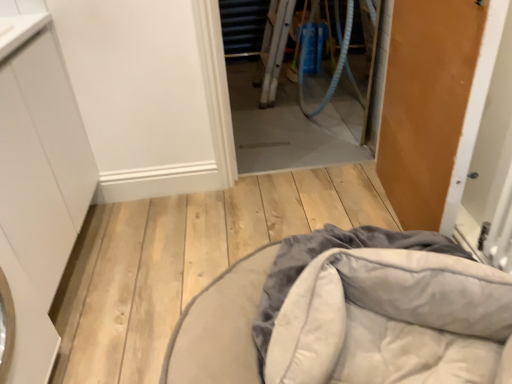
Question: Is transparent plastic screen door at center wider than white matte cabinet at left?

Choices:
 (A) no
 (B) yes

Answer: (A)

Question: From the image's perspective, is transparent plastic screen door at center below white matte cabinet at left?

Choices:
 (A) yes
 (B) no

Answer: (B)

Question: From a real-world perspective, is transparent plastic screen door at center located beneath white matte cabinet at left?

Choices:
 (A) yes
 (B) no

Answer: (A)

Question: Is transparent plastic screen door at center far from white matte cabinet at left?

Choices:
 (A) no
 (B) yes

Answer: (B)

Question: Is transparent plastic screen door at center looking in the opposite direction of white matte cabinet at left?

Choices:
 (A) yes
 (B) no

Answer: (B)

Question: In the image, is transparent plastic screen door at center positioned in front of or behind white matte cabinet at left?

Choices:
 (A) behind
 (B) front

Answer: (A)

Question: Is transparent plastic screen door at center wider or thinner than white matte cabinet at left?

Choices:
 (A) thin
 (B) wide

Answer: (A)

Question: From a real-world perspective, is transparent plastic screen door at center above or below white matte cabinet at left?

Choices:
 (A) below
 (B) above

Answer: (A)

Question: Is transparent plastic screen door at center bigger or smaller than white matte cabinet at left?

Choices:
 (A) small
 (B) big

Answer: (A)

Question: From the image's perspective, is transparent plastic screen door at center above or below wooden door at right?

Choices:
 (A) below
 (B) above

Answer: (B)

Question: Does point (300, 94) appear closer or farther from the camera than point (432, 71)?

Choices:
 (A) closer
 (B) farther

Answer: (B)

Question: Considering the relative positions of transparent plastic screen door at center and wooden door at right in the image provided, is transparent plastic screen door at center to the left or to the right of wooden door at right?

Choices:
 (A) right
 (B) left

Answer: (B)

Question: From their relative heights in the image, would you say transparent plastic screen door at center is taller or shorter than wooden door at right?

Choices:
 (A) short
 (B) tall

Answer: (A)

Question: From a real-world perspective, relative to white matte cabinet at left, is velvet gray cushion at lower center vertically above or below?

Choices:
 (A) below
 (B) above

Answer: (A)

Question: From the image's perspective, relative to white matte cabinet at left, is velvet gray cushion at lower center above or below?

Choices:
 (A) above
 (B) below

Answer: (B)